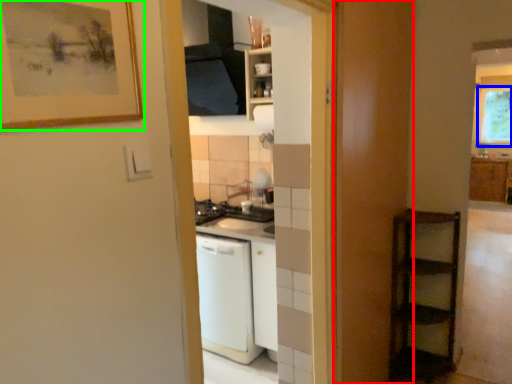
Question: Which object is positioned closest to screen door (highlighted by a red box)? Select from window (highlighted by a blue box) and picture frame (highlighted by a green box).

Choices:
 (A) window
 (B) picture frame

Answer: (B)